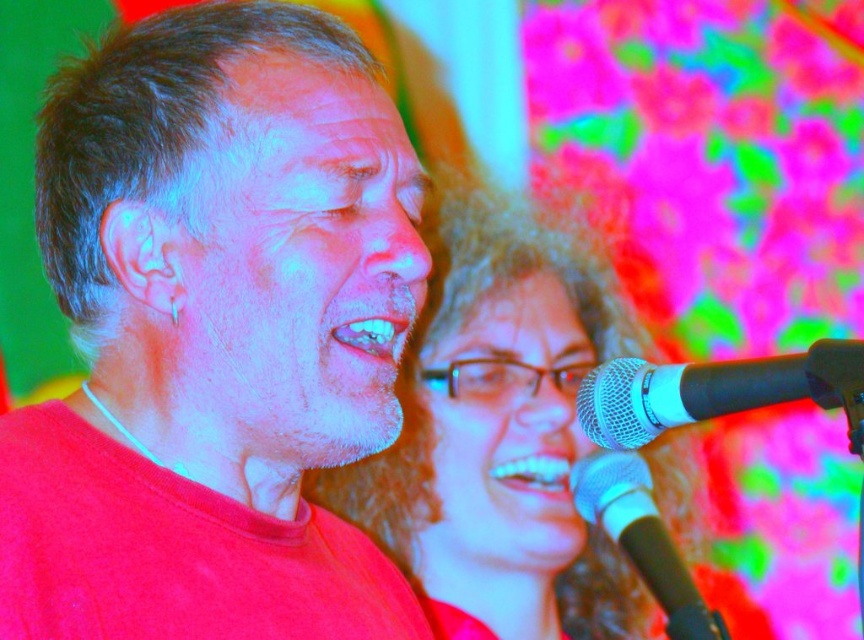
You are a stagehand setting up equipment for a performance. You have two microphones, the black matte microphone at lower right and the black metallic microphone at lower right. The stage manager requires that the microphones be placed exactly 2 feet apart. Based on the scene, will the current spacing between them meet the requirement?

The distance between the black matte microphone at lower right and the black metallic microphone at lower right is 21.55 inches, which is approximately 1.8 feet. Since the required distance is 2 feet, the current spacing is insufficient and does not meet the requirement.

You are a photographer trying to capture a closeup of the smooth glossy teeth at center. The black matte microphone at lower right is blocking your shot. Can you move the microphone to the side to get a clear view?

The black matte microphone at lower right is positioned under the smooth glossy teeth at center, so moving it to the side would allow a clear view of the smooth glossy teeth at center.

You are a stagehand setting up for a concert. You need to adjust the height of the microphone stand so that the black metallic microphone at lower right is at least as tall as the matte plastic hair at center. Is the microphone currently tall enough?

The matte plastic hair at center is much taller than the black metallic microphone at lower right, so the microphone is not tall enough. You need to adjust the stand to raise it to match or exceed the height of the matte plastic hair at center.